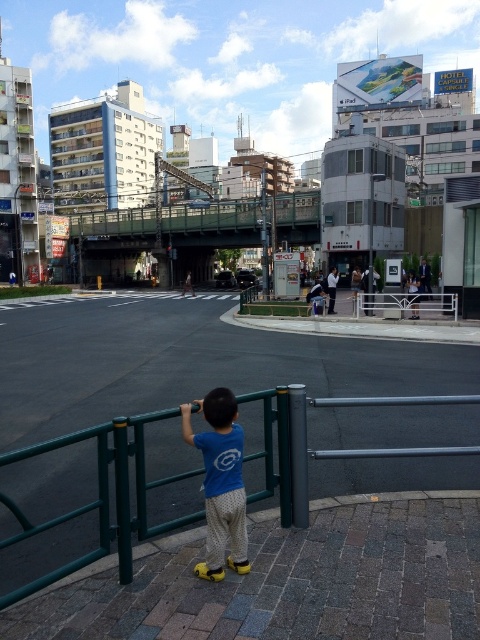
Question: Considering the relative positions of green metal fence at lower center and blue cotton shirt at center in the image provided, where is green metal fence at lower center located with respect to blue cotton shirt at center?

Choices:
 (A) right
 (B) left

Answer: (B)

Question: Is green metal fence at lower center above blue cotton shirt at center?

Choices:
 (A) yes
 (B) no

Answer: (B)

Question: In this image, where is green metal fence at lower center located relative to blue cotton shirt at center?

Choices:
 (A) left
 (B) right

Answer: (A)

Question: Among these objects, which one is farthest from the camera?

Choices:
 (A) blue cotton shirt at center
 (B) green metal fence at lower center

Answer: (A)

Question: Which point is farther to the camera?

Choices:
 (A) blue cotton shirt at center
 (B) green metal fence at lower center

Answer: (A)